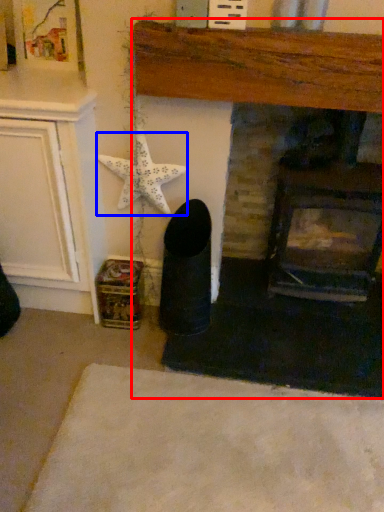
Question: Which object is further to the camera taking this photo, fireplace (highlighted by a red box) or starfish (highlighted by a blue box)?

Choices:
 (A) fireplace
 (B) starfish

Answer: (B)